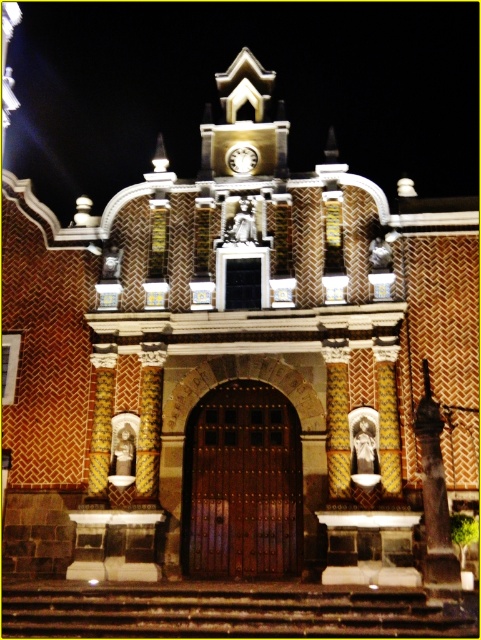
Question: Can you confirm if dark brown stone statue at right is positioned above metallic clock face at center?

Choices:
 (A) no
 (B) yes

Answer: (A)

Question: Which object is positioned closest to the metallic clock face at center?

Choices:
 (A) dark brown stone statue at right
 (B) brick building at center

Answer: (A)

Question: Where is dark brown stone statue at right located in relation to metallic clock face at center in the image?

Choices:
 (A) left
 (B) right

Answer: (B)

Question: Considering the real-world distances, which object is closest to the brick building at center?

Choices:
 (A) metallic clock face at center
 (B) dark brown stone statue at right

Answer: (A)

Question: Is the position of dark brown stone statue at right less distant than that of metallic clock face at center?

Choices:
 (A) no
 (B) yes

Answer: (B)

Question: Which point appears farthest from the camera in this image?

Choices:
 (A) (431, 444)
 (B) (118, 97)

Answer: (B)